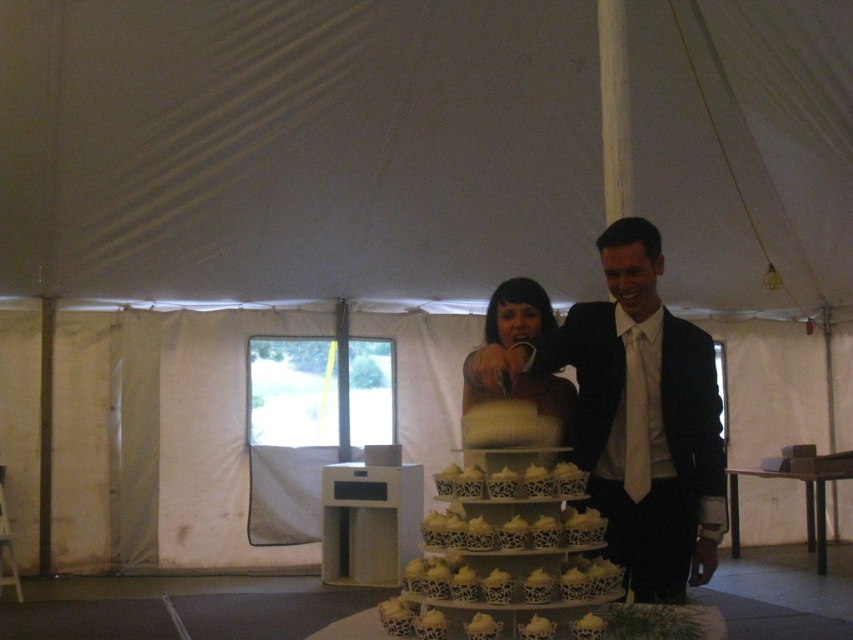
Question: Which point appears closest to the camera in this image?

Choices:
 (A) (515, 387)
 (B) (454, 632)
 (C) (6, 51)
 (D) (608, 321)

Answer: (B)

Question: Does matte black suit at center appear on the left side of matte white cake at center?

Choices:
 (A) no
 (B) yes

Answer: (A)

Question: Which point appears farthest from the camera in this image?

Choices:
 (A) (602, 419)
 (B) (399, 627)
 (C) (311, 294)

Answer: (C)

Question: Which of the following is the farthest from the observer?

Choices:
 (A) matte white cake at center
 (B) white lace cupcake tower at center

Answer: (A)

Question: Is white fabric canopy at upper center above white lace cupcake tower at center?

Choices:
 (A) no
 (B) yes

Answer: (B)

Question: Does matte black suit at center appear on the right side of matte white cake at center?

Choices:
 (A) no
 (B) yes

Answer: (B)